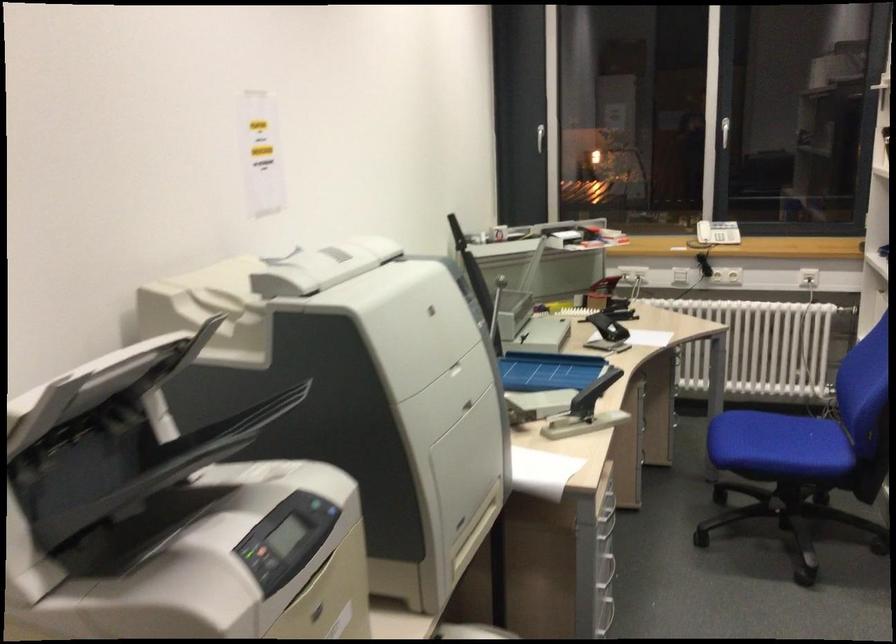
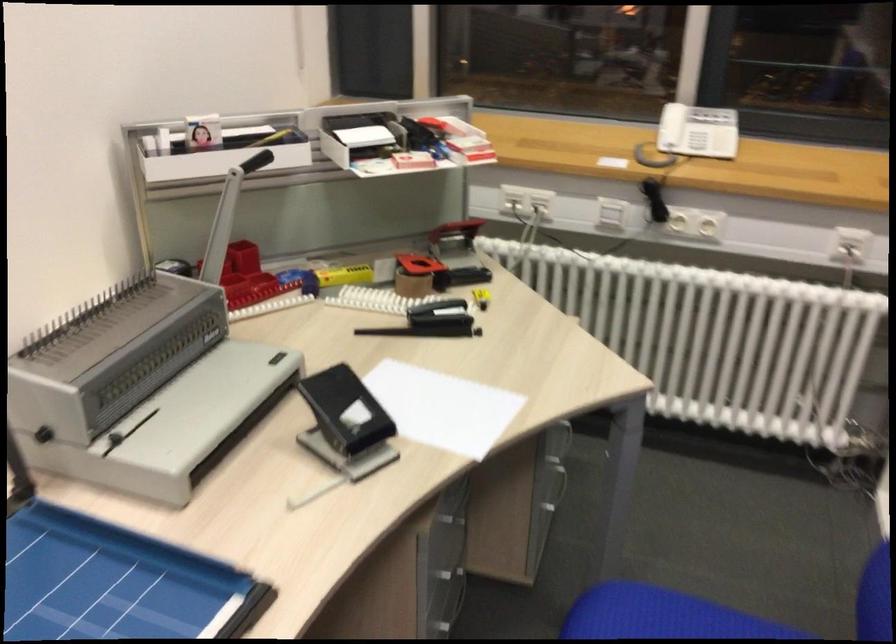
Locate, in the second image, the point that corresponds to [607,285] in the first image.

(454, 236)